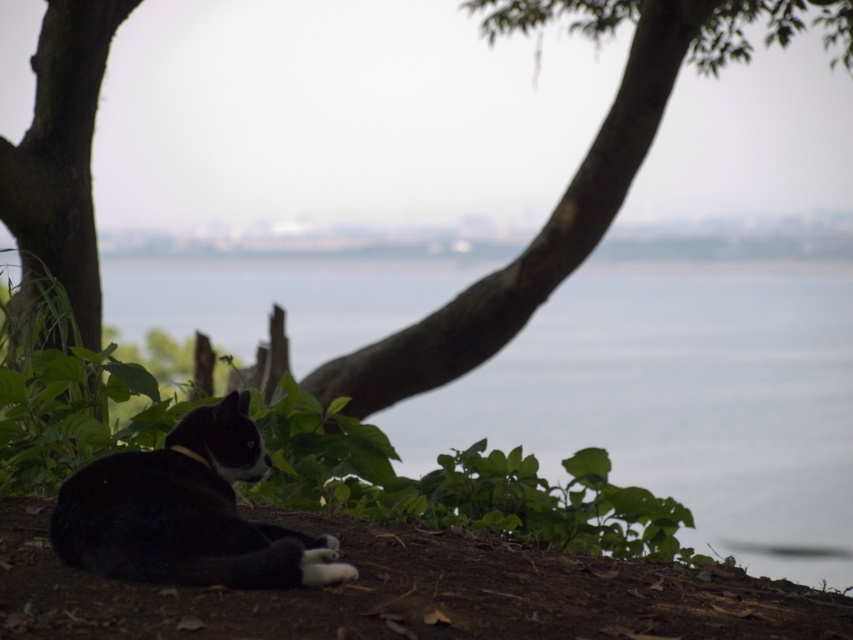
Does transparent water at center have a lesser height compared to black fur cat at lower left?

Incorrect, transparent water at center's height does not fall short of black fur cat at lower left's.

Is transparent water at center to the right of black fur cat at lower left from the viewer's perspective?

Indeed, transparent water at center is positioned on the right side of black fur cat at lower left.

Is point (772, 340) in front of point (178, 509)?

No, it is not.

Image resolution: width=853 pixels, height=640 pixels. What are the coordinates of `transparent water at center` in the screenshot? It's located at (675, 394).

Which of these two, black fur cat at lower left or smooth bark tree trunk at left, stands shorter?

Standing shorter between the two is black fur cat at lower left.

Is black fur cat at lower left wider than smooth bark tree trunk at left?

No, black fur cat at lower left is not wider than smooth bark tree trunk at left.

Between point (231, 412) and point (45, 243), which one is positioned behind?

The point (45, 243) is more distant.

The width and height of the screenshot is (853, 640). I want to click on black fur cat at lower left, so click(x=187, y=513).

Is transparent water at center thinner than smooth bark tree trunk at left?

In fact, transparent water at center might be wider than smooth bark tree trunk at left.

Can you confirm if transparent water at center is positioned below smooth bark tree trunk at left?

Yes.

This screenshot has width=853, height=640. I want to click on transparent water at center, so click(675, 394).